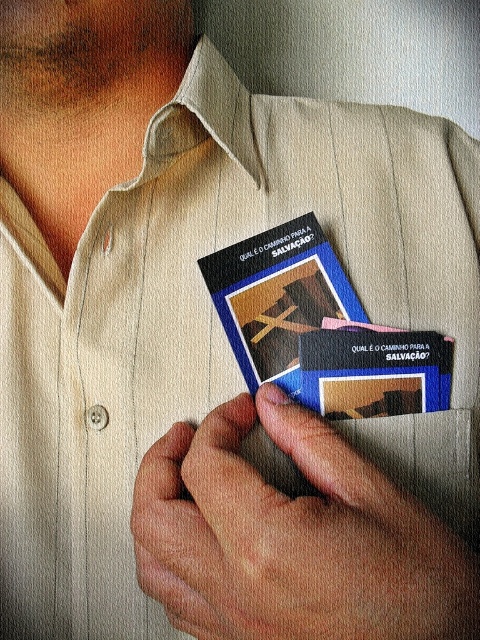
Based on the scene description, where is the smooth skin hand at center located in the image?

The smooth skin hand at center is located at point (292, 538) in the image.

You are a graphic designer asked to place a sticker between the blue glossy book at center and the blue cardboard business card at center. The sticker needs to be exactly 1 inch wide. Can you fit the sticker between them?

The blue glossy book at center is 0.65 inches from blue cardboard business card at center. Since the distance between them is less than 1 inch, the sticker cannot fit between them.